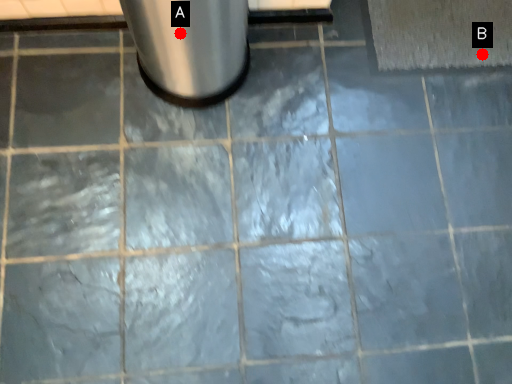
Question: Two points are circled on the image, labeled by A and B beside each circle. Which point is farther from the camera taking this photo?

Choices:
 (A) A is further
 (B) B is further

Answer: (B)